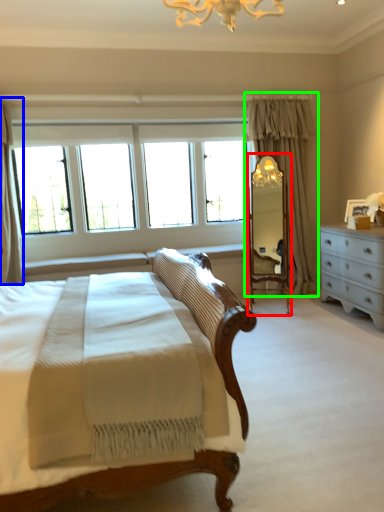
Question: Which object is the closest to the mirror (highlighted by a red box)? Choose among these: curtain (highlighted by a blue box) or curtain (highlighted by a green box).

Choices:
 (A) curtain
 (B) curtain

Answer: (B)